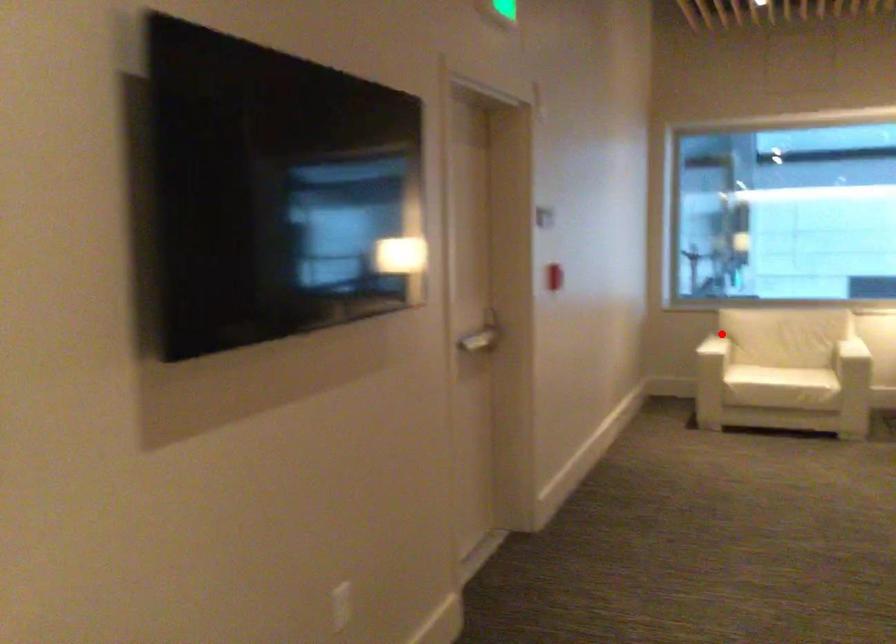
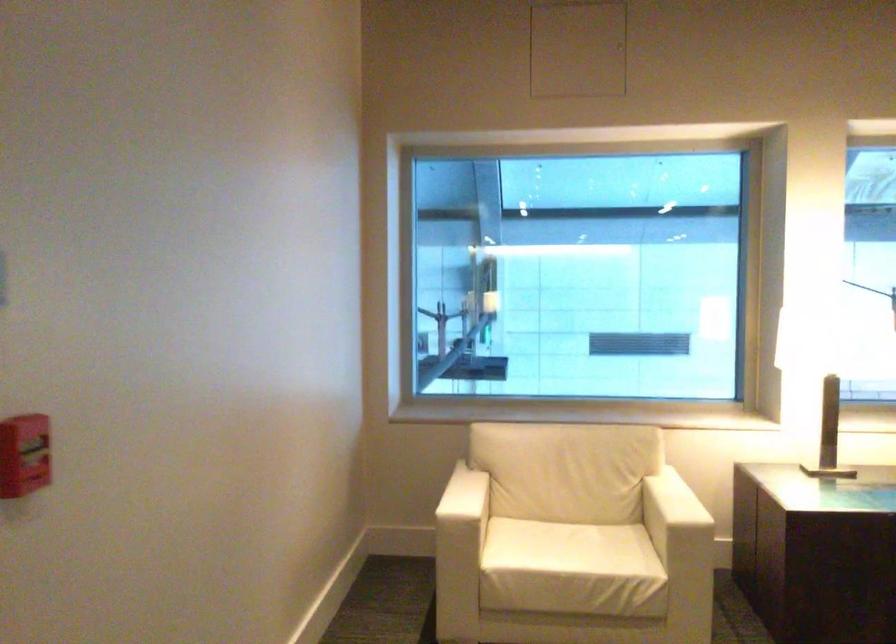
Question: I am providing you with two images of the same scene from different viewpoints. Given a red point in image1, look at the same physical point in image2. Is it:

Choices:
 (A) Closer to the viewpoint
 (B) Farther from the viewpoint

Answer: (A)